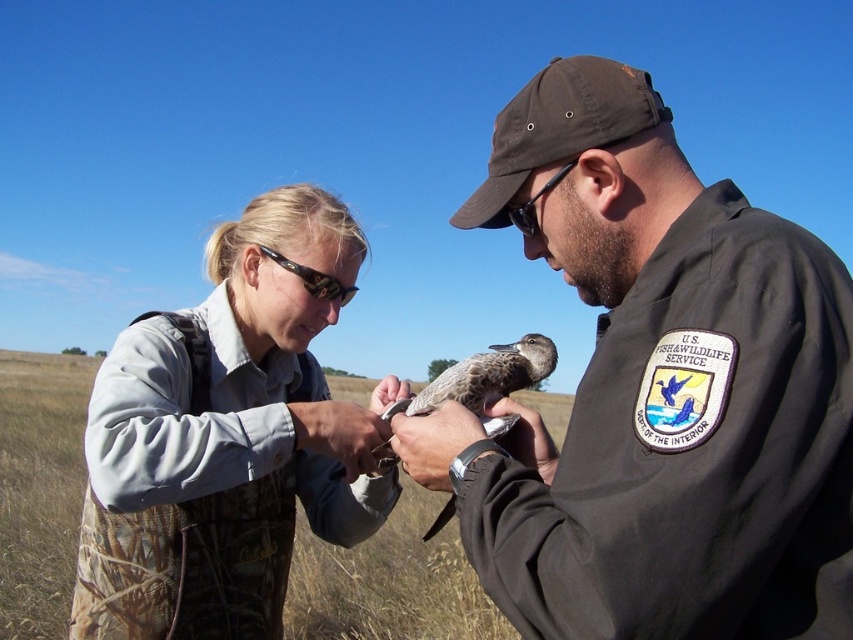
You are a visitor at a wildlife sanctuary and see the brown uniform at center and the tortoiseshell plastic goggles at upper center. Which object is taller?

The brown uniform at center is much taller than the tortoiseshell plastic goggles at upper center.

You are a wildlife photographer trying to capture a closeup shot of the speckled feathered duckling at center and the tortoiseshell plastic goggles at upper center. If your camera can only focus on one object at a time, which object should you zoom in on to ensure it fills the frame more completely?

The speckled feathered duckling at center is bigger than the tortoiseshell plastic goggles at upper center, so you should zoom in on the speckled feathered duckling at center to ensure it fills the frame more completely.